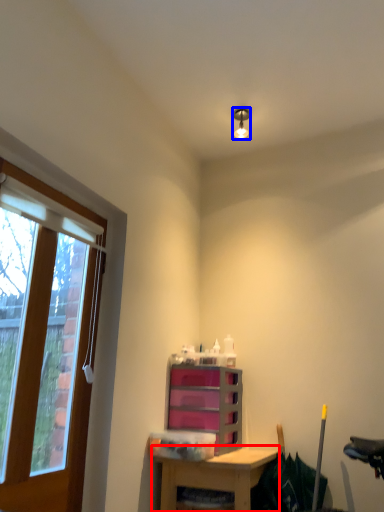
Question: Which of the following is the farthest to the observer, desk (highlighted by a red box) or light fixture (highlighted by a blue box)?

Choices:
 (A) desk
 (B) light fixture

Answer: (B)